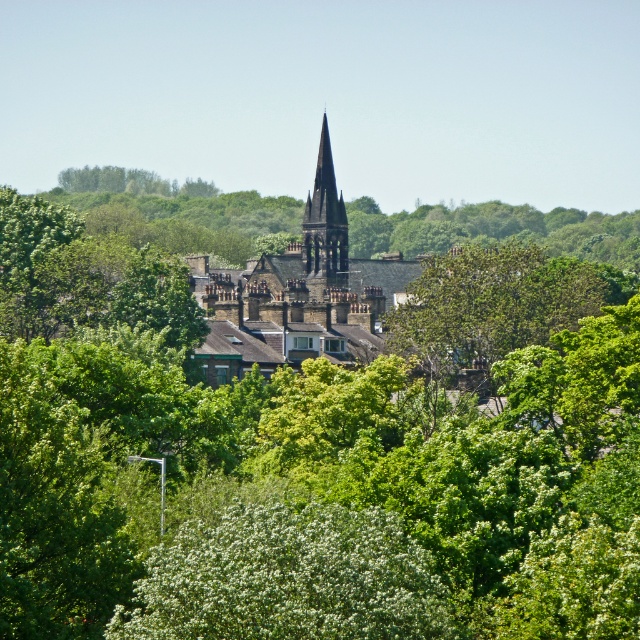
Does green leafy tree at center have a greater height compared to dark gray stone tower at center?

No, green leafy tree at center is not taller than dark gray stone tower at center.

Is green leafy tree at center to the right of dark gray stone tower at center from the viewer's perspective?

Correct, you'll find green leafy tree at center to the right of dark gray stone tower at center.

I want to click on green leafy tree at center, so click(x=493, y=305).

Which is below, dark gray stone church steeple at center or green leafy tree at center?

green leafy tree at center

Is dark gray stone church steeple at center to the left of green leafy tree at center from the viewer's perspective?

Yes, dark gray stone church steeple at center is to the left of green leafy tree at center.

Measure the distance between point [371,307] and camera.

They are 180.93 meters apart.

Where is `dark gray stone church steeple at center`? The width and height of the screenshot is (640, 640). dark gray stone church steeple at center is located at coordinates (298, 292).

Which is below, dark gray stone church steeple at center or dark gray stone tower at center?

dark gray stone church steeple at center is lower down.

Which of these two, dark gray stone church steeple at center or dark gray stone tower at center, stands taller?

With more height is dark gray stone church steeple at center.

Is point (243, 342) farther from camera compared to point (333, 216)?

No, it is not.

Locate an element on the screen. dark gray stone church steeple at center is located at coordinates [x=298, y=292].